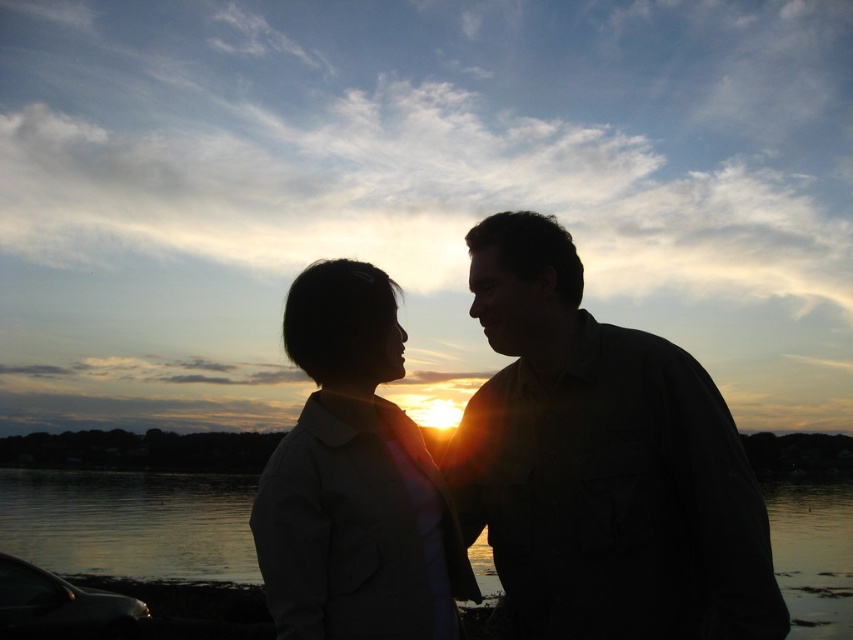
You are a photographer trying to capture the sunset scene. You want to ensure both the silhouette couple at center and the glossy water at center are clearly visible in your shot. Given their sizes, which object might require you to adjust your camera focus more carefully?

The silhouette couple at center has a smaller size compared to the glossy water at center, so the silhouette couple at center might require more careful focus adjustment to ensure clarity in the photograph.

Looking at this image, you are a photographer trying to capture the sunset scene. You notice the silhouette couple at center and the matte beige jacket at center. Which object is positioned more to the left in the image?

The matte beige jacket at center is positioned more to the left than the silhouette couple at center.

You are standing at a point 2.42 meters away from the sunset scene. If you want to take a photo of the silhouetted individuals, where should you position yourself relative to the point at coordinates point (294, 499)?

The point at coordinates point (294, 499) is 2.42 meters away from the viewer. To take a photo of the silhouetted individuals, you should position yourself at the point (294, 499) since it is exactly 2.42 meters away from the scene.